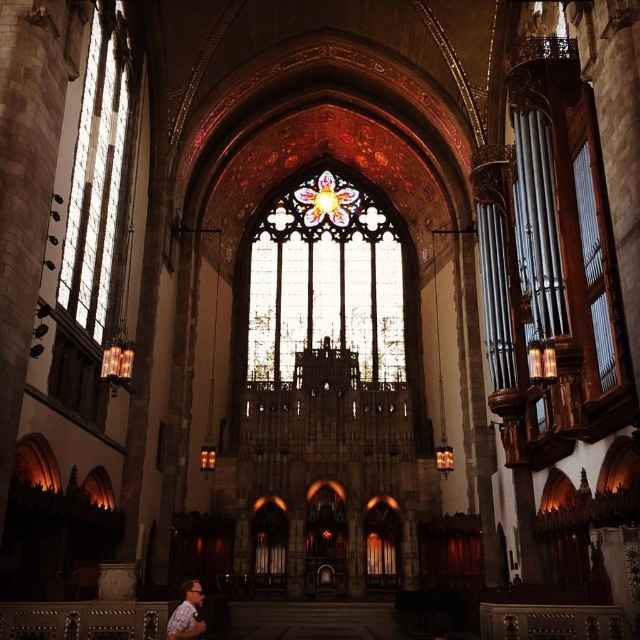
Question: Does stained glass at center have a larger size compared to clear glass window at left?

Choices:
 (A) no
 (B) yes

Answer: (B)

Question: Estimate the real-world distances between objects in this image. Which object is closer to the stained glass at center?

Choices:
 (A) clear glass window at left
 (B) printed cotton shirt at lower left

Answer: (A)

Question: Is clear glass window at left thinner than printed cotton shirt at lower left?

Choices:
 (A) yes
 (B) no

Answer: (A)

Question: Which object is the closest to the clear glass window at left?

Choices:
 (A) printed cotton shirt at lower left
 (B) stained glass at center

Answer: (A)

Question: Is stained glass at center closer to the viewer compared to printed cotton shirt at lower left?

Choices:
 (A) yes
 (B) no

Answer: (B)

Question: Which point is farther to the camera?

Choices:
 (A) (97, 276)
 (B) (164, 636)
 (C) (400, 387)

Answer: (C)